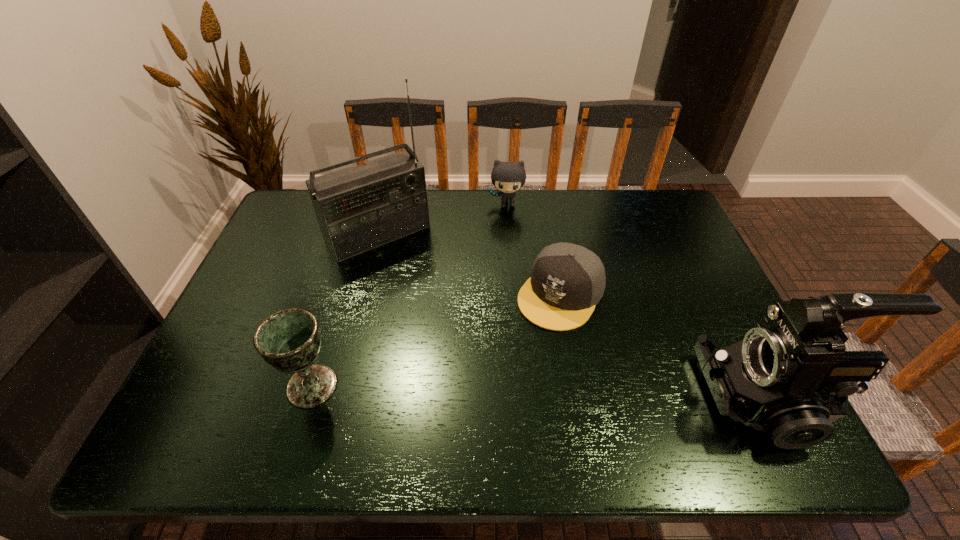
Image resolution: width=960 pixels, height=540 pixels. Find the location of `chalice`. chalice is located at coordinates (289, 340).

Where is `the rightmost object`? The height and width of the screenshot is (540, 960). the rightmost object is located at coordinates (786, 376).

At what (x,y) coordinates should I click in order to perform the action: click on the fourth shortest object. Please return your answer as a coordinate pair (x, y). The height and width of the screenshot is (540, 960). Looking at the image, I should click on (786, 376).

This screenshot has width=960, height=540. I want to click on the tallest object, so click(360, 208).

Identify the location of cap. The width and height of the screenshot is (960, 540). (567, 281).

What are the coordinates of `the fourth tallest object` in the screenshot? It's located at (508, 177).

Locate an element on the screen. The width and height of the screenshot is (960, 540). vacant region located 0.200m on the right of the chalice is located at coordinates (428, 386).

You are a GUI agent. You are given a task and a screenshot of the screen. Output one action in this format:
    pyautogui.click(x=<x>, y=<y>)
    Task: Click on the free space located 0.300m on the lens mount of the rightmost object
    The height and width of the screenshot is (540, 960).
    Given the screenshot: What is the action you would take?
    pyautogui.click(x=569, y=398)

The width and height of the screenshot is (960, 540). In order to click on free space located 0.090m on the lens mount of the rightmost object in this screenshot , I will do `click(665, 398)`.

You are a GUI agent. You are given a task and a screenshot of the screen. Output one action in this format:
    pyautogui.click(x=<x>, y=<y>)
    Task: Click on the vacant space located 0.330m on the lens mount of the rightmost object
    The width and height of the screenshot is (960, 540).
    Given the screenshot: What is the action you would take?
    pyautogui.click(x=556, y=398)